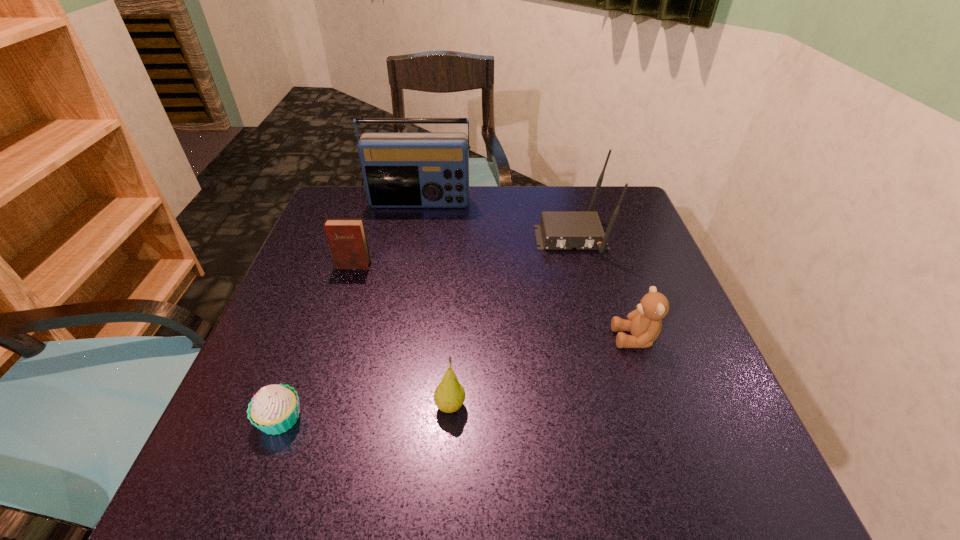
The image size is (960, 540). I want to click on the farthest object, so click(400, 169).

I want to click on radio receiver, so click(400, 169).

Identify the location of the fifth shortest object. The height and width of the screenshot is (540, 960). (557, 230).

The height and width of the screenshot is (540, 960). In order to click on router in this screenshot , I will do `click(557, 230)`.

Where is `the fourth nearest object`? the fourth nearest object is located at coordinates (347, 240).

Identify the location of the fourth farthest object. This screenshot has width=960, height=540. (644, 324).

I want to click on pear, so click(x=449, y=395).

Locate an element on the screen. This screenshot has height=540, width=960. the shortest object is located at coordinates (274, 409).

Where is `vacant space situated 0.200m on the front panel of the farthest object`? Image resolution: width=960 pixels, height=540 pixels. vacant space situated 0.200m on the front panel of the farthest object is located at coordinates (410, 258).

Identify the location of vacant space located on the back of the router to connect cables. (598, 347).